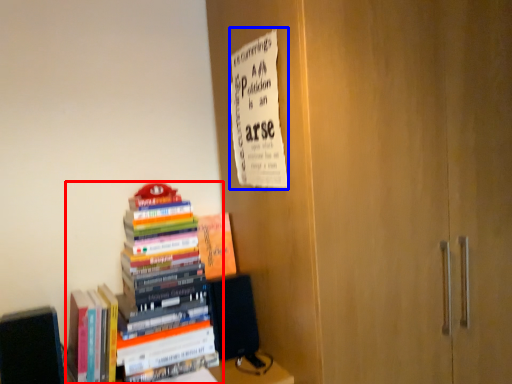
Question: Which point is further to the camera, book (highlighted by a red box) or paperback book (highlighted by a blue box)?

Choices:
 (A) book
 (B) paperback book

Answer: (A)